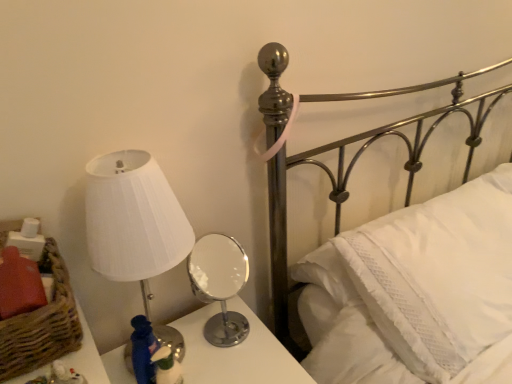
You are a GUI agent. You are given a task and a screenshot of the screen. Output one action in this format:
    pyautogui.click(x=<x>, y=<y>)
    Task: Click on the free point to the right of white pleated fabric lampshade at left
    
    Given the screenshot: What is the action you would take?
    pyautogui.click(x=249, y=362)